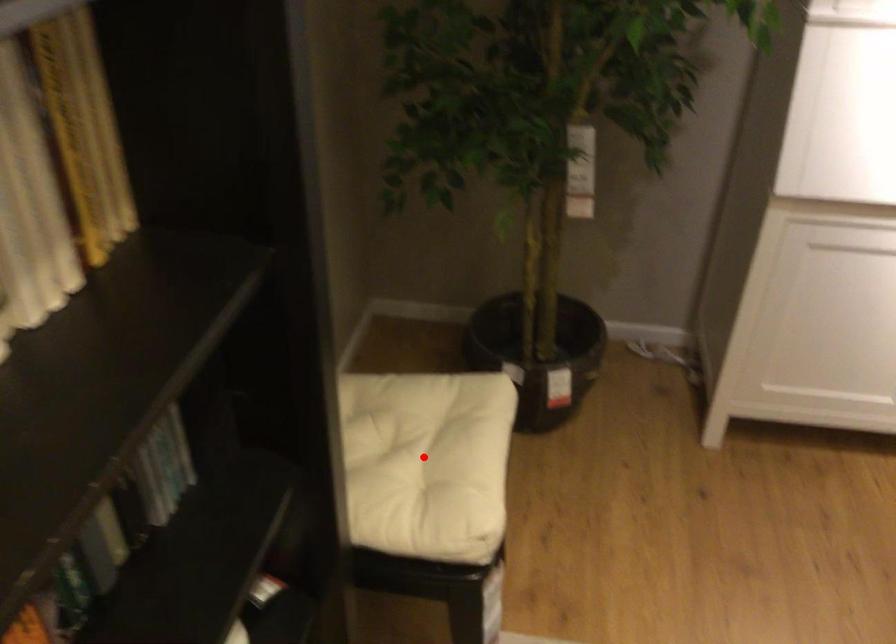
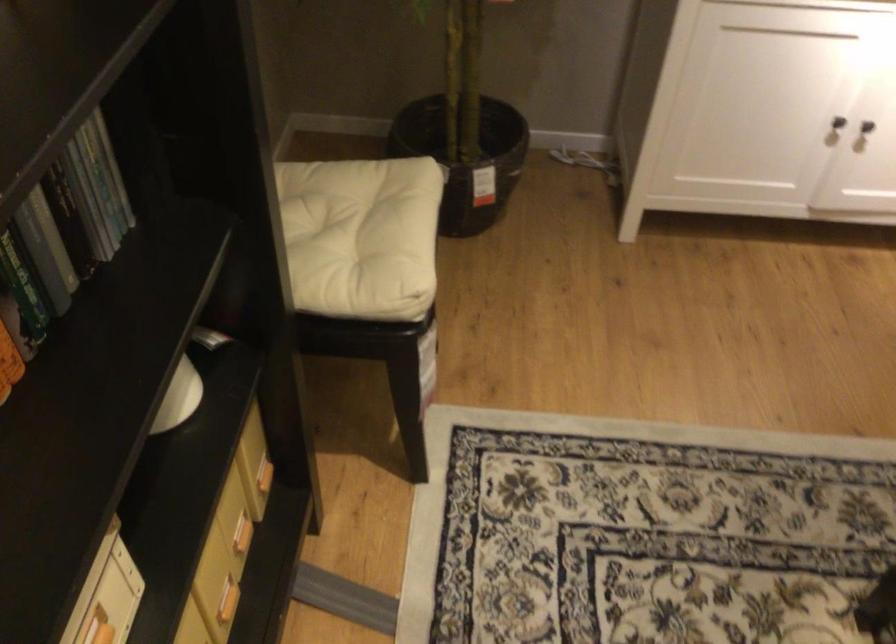
In the second image, find the point that corresponds to the highlighted location in the first image.

(355, 234)